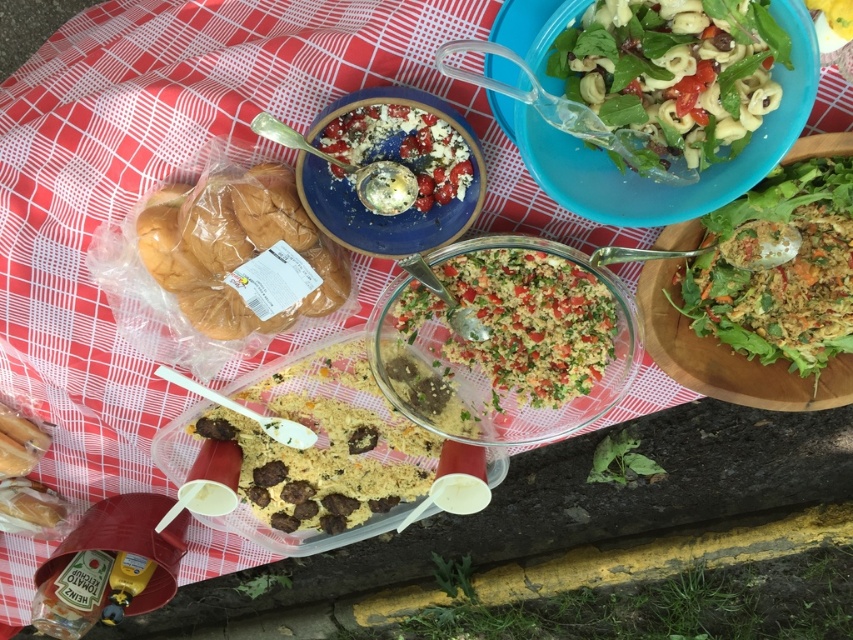
You are planning to serve food from both the brown crumbly mix at center and the green crumbly salad at center. If you want to choose the wider dish to place a large serving spoon, which one should you select?

The brown crumbly mix at center is wider than the green crumbly salad at center, so you should select the brown crumbly mix at center to place the large serving spoon.

You are organizing a picnic and see the green leafy salad at upper right and the green crumbly salad at center. Which salad is located to the right of the other?

The green leafy salad at upper right is positioned on the right side of the green crumbly salad at center.